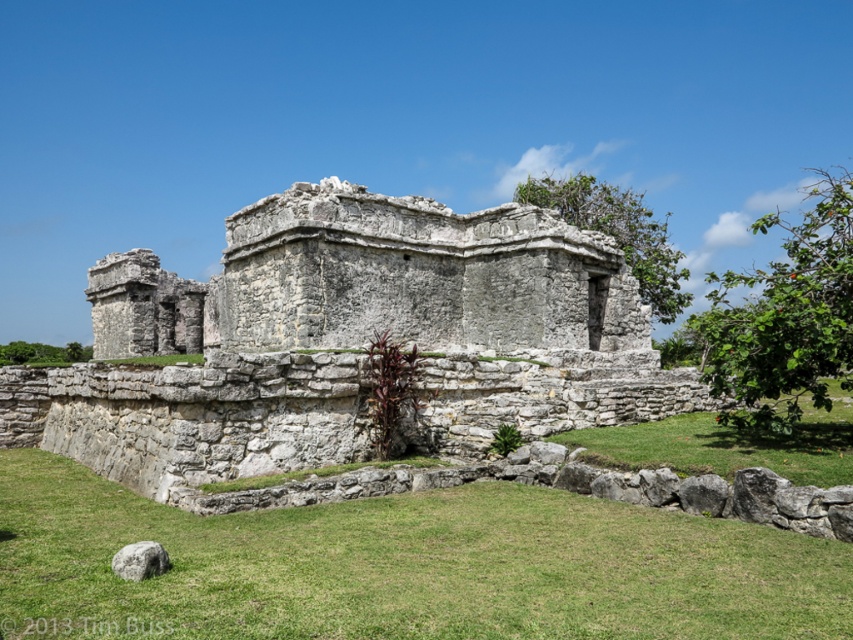
Can you confirm if gray stone ruins at center is positioned to the right of transparent watermark at lower left?

In fact, gray stone ruins at center is to the left of transparent watermark at lower left.

From the picture: Between gray stone ruins at center and transparent watermark at lower left, which one is positioned lower?

Positioned lower is transparent watermark at lower left.

Between point (225, 305) and point (28, 625), which one is positioned in front?

Point (28, 625) is in front.

Locate an element on the screen. This screenshot has width=853, height=640. gray stone ruins at center is located at coordinates [x=347, y=340].